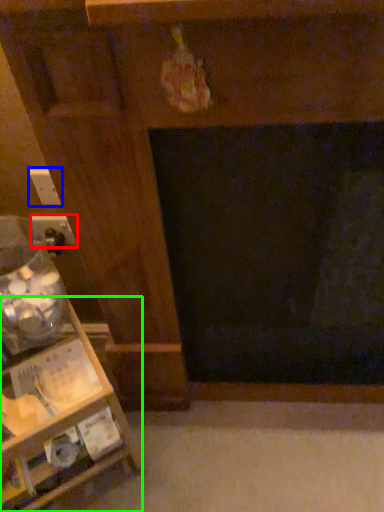
Question: Based on their relative distances, which object is farther from electric outlet (highlighted by a red box)? Choose from electric outlet (highlighted by a blue box) and furniture (highlighted by a green box).

Choices:
 (A) electric outlet
 (B) furniture

Answer: (B)